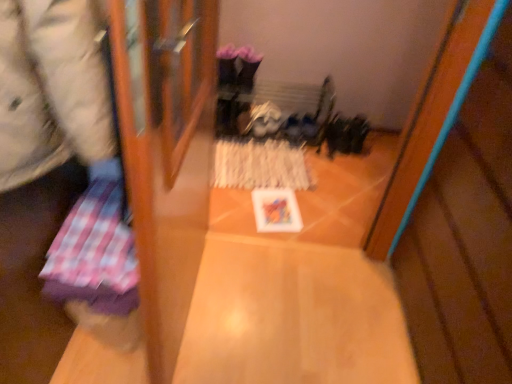
I want to click on free space in front of white textured paper at center, positioned as the first wrapping paper in back-to-front order, so click(x=269, y=206).